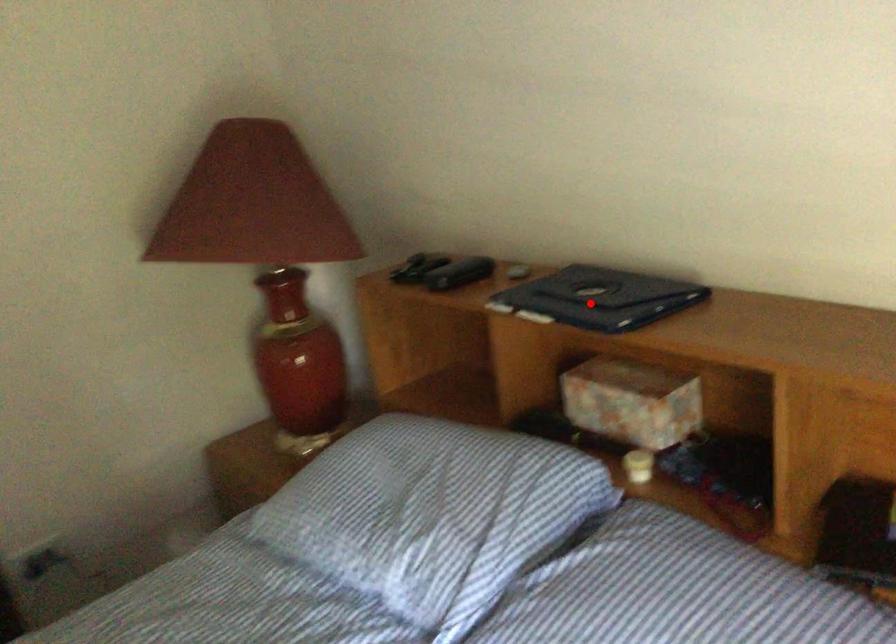
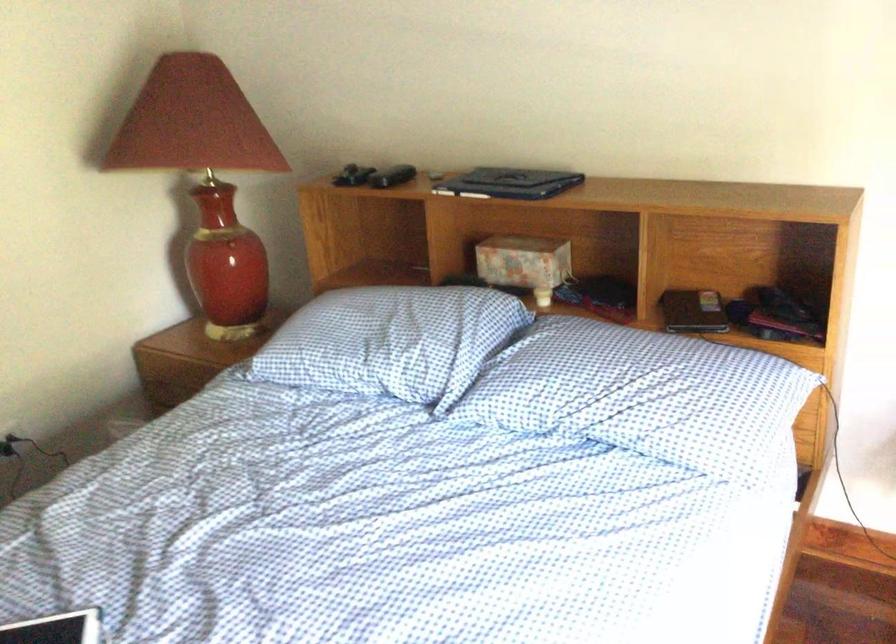
Question: I am providing you with two images of the same scene from different viewpoints. Given a red point in image1, look at the same physical point in image2. Is it:

Choices:
 (A) Closer to the viewpoint
 (B) Farther from the viewpoint

Answer: (B)